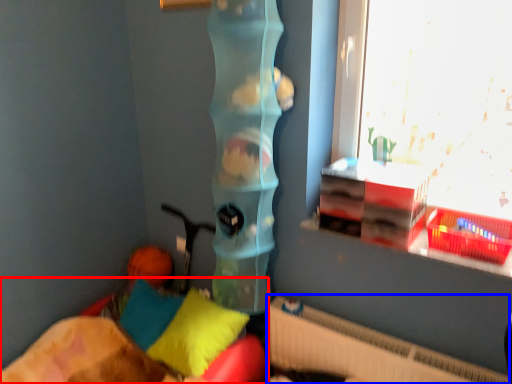
Question: Which object is further to the camera taking this photo, furniture (highlighted by a red box) or radiator (highlighted by a blue box)?

Choices:
 (A) furniture
 (B) radiator

Answer: (B)